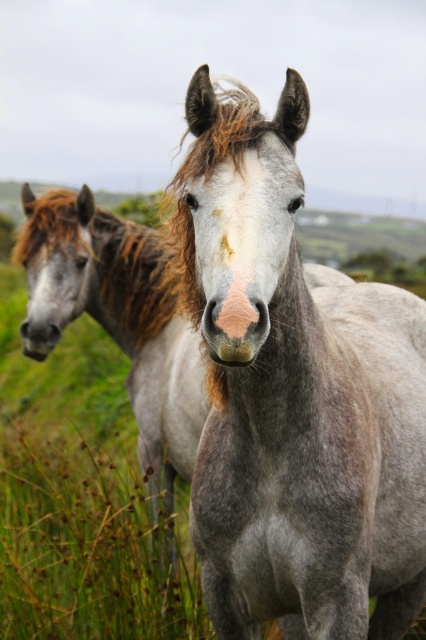
Describe the element at coordinates (293, 396) in the screenshot. This screenshot has width=426, height=640. I see `gray matte horse at center` at that location.

Who is lower down, gray matte horse at center or gray matte horse at left?

gray matte horse at left

I want to click on gray matte horse at center, so click(x=293, y=396).

Locate an element on the screen. This screenshot has height=640, width=426. gray matte horse at center is located at coordinates (293, 396).

Is point (330, 458) positioned after point (118, 220)?

No, it is not.

At what (x,y) coordinates should I click in order to perform the action: click on gray matte horse at center. Please return your answer as a coordinate pair (x, y). Image resolution: width=426 pixels, height=640 pixels. Looking at the image, I should click on (293, 396).

Is point (86, 307) closer to viewer compared to point (120, 227)?

Yes.

Identify the location of gray matte horse at left. The image size is (426, 640). (117, 320).